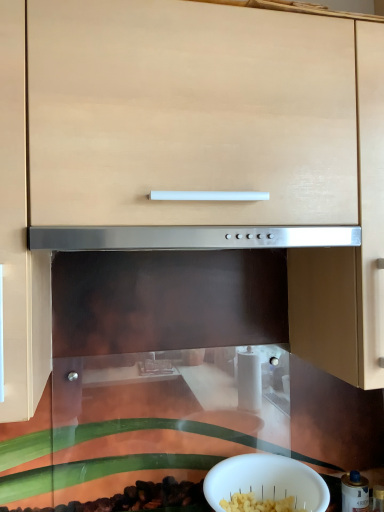
Question: Considering the relative sizes of white matte bowl at lower center and metallic silver canister at lower right in the image provided, is white matte bowl at lower center bigger than metallic silver canister at lower right?

Choices:
 (A) yes
 (B) no

Answer: (A)

Question: Is white matte bowl at lower center to the left of metallic silver canister at lower right from the viewer's perspective?

Choices:
 (A) yes
 (B) no

Answer: (A)

Question: Is white matte bowl at lower center completely or partially outside of metallic silver canister at lower right?

Choices:
 (A) yes
 (B) no

Answer: (A)

Question: Is white matte bowl at lower center far from metallic silver canister at lower right?

Choices:
 (A) no
 (B) yes

Answer: (A)

Question: Does white matte bowl at lower center have a lesser height compared to metallic silver canister at lower right?

Choices:
 (A) no
 (B) yes

Answer: (B)

Question: Is metallic silver canister at lower right located within white matte bowl at lower center?

Choices:
 (A) no
 (B) yes

Answer: (A)

Question: Is metallic silver canister at lower right far away from white matte bowl at lower center?

Choices:
 (A) no
 (B) yes

Answer: (A)

Question: Is metallic silver canister at lower right bigger than white matte bowl at lower center?

Choices:
 (A) yes
 (B) no

Answer: (B)

Question: Is metallic silver canister at lower right wider than white matte bowl at lower center?

Choices:
 (A) yes
 (B) no

Answer: (B)

Question: Is metallic silver canister at lower right at the right side of white matte bowl at lower center?

Choices:
 (A) yes
 (B) no

Answer: (A)

Question: From the image's perspective, is metallic silver canister at lower right on top of white matte bowl at lower center?

Choices:
 (A) yes
 (B) no

Answer: (B)

Question: Is white matte bowl at lower center a part of metallic silver canister at lower right?

Choices:
 (A) yes
 (B) no

Answer: (B)

Question: Is white matte bowl at lower center inside or outside of metallic silver canister at lower right?

Choices:
 (A) inside
 (B) outside

Answer: (B)